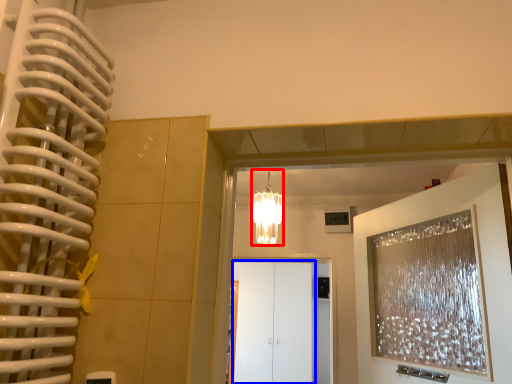
Question: Which object appears closest to the camera in this image, lamp (highlighted by a red box) or glass door (highlighted by a blue box)?

Choices:
 (A) lamp
 (B) glass door

Answer: (A)